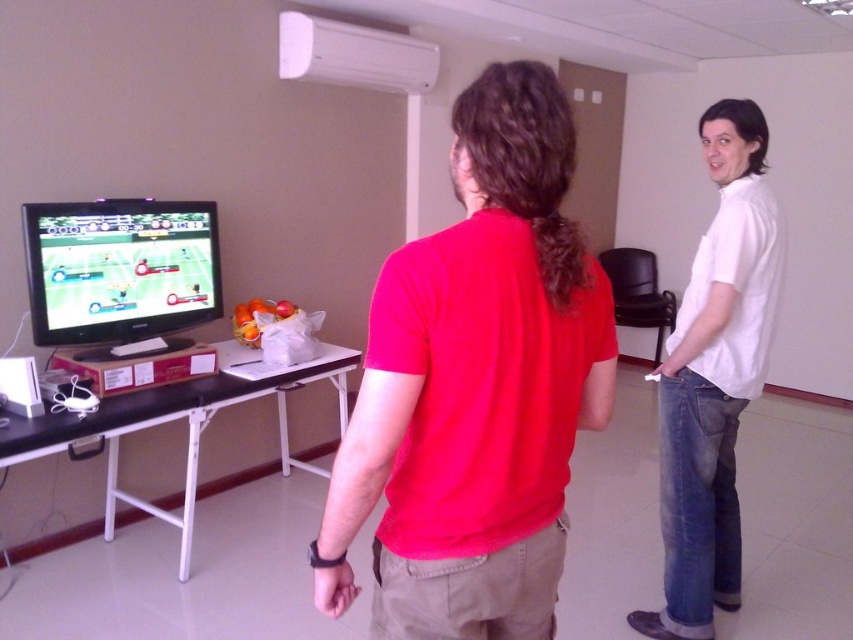
Question: Is the position of red matte shirt at center more distant than that of matte black television at left?

Choices:
 (A) no
 (B) yes

Answer: (A)

Question: Considering the real-world distances, which object is farthest from the matte black television at left?

Choices:
 (A) red matte shirt at center
 (B) white cotton shirt at right

Answer: (B)

Question: Is the position of red matte shirt at center less distant than that of white cotton shirt at right?

Choices:
 (A) no
 (B) yes

Answer: (B)

Question: Does red matte shirt at center appear on the right side of white cotton shirt at right?

Choices:
 (A) no
 (B) yes

Answer: (A)

Question: Which point is closer to the camera taking this photo?

Choices:
 (A) (727, 516)
 (B) (180, 307)
 (C) (509, 227)

Answer: (C)

Question: Which object appears closest to the camera in this image?

Choices:
 (A) red matte shirt at center
 (B) matte black television at left
 (C) white cotton shirt at right

Answer: (A)